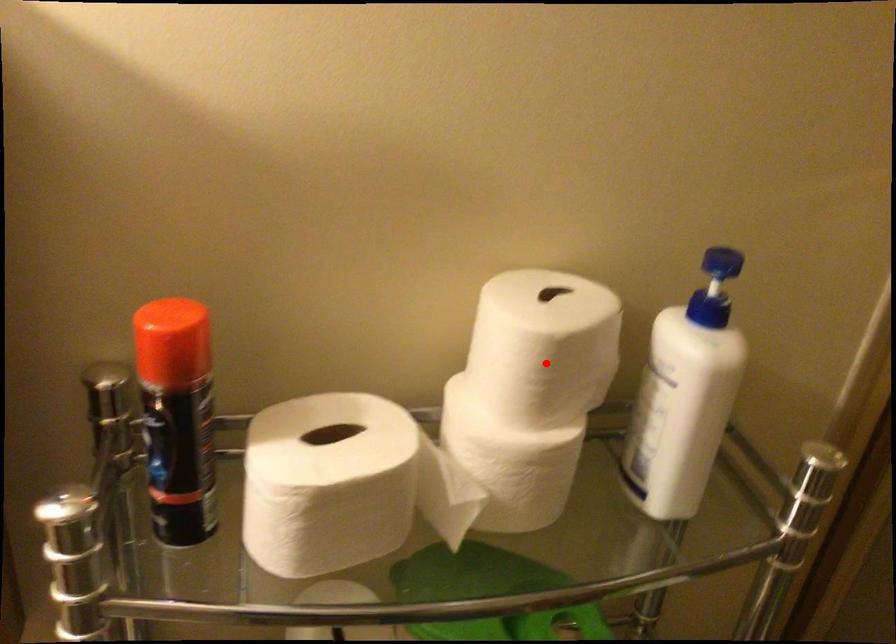
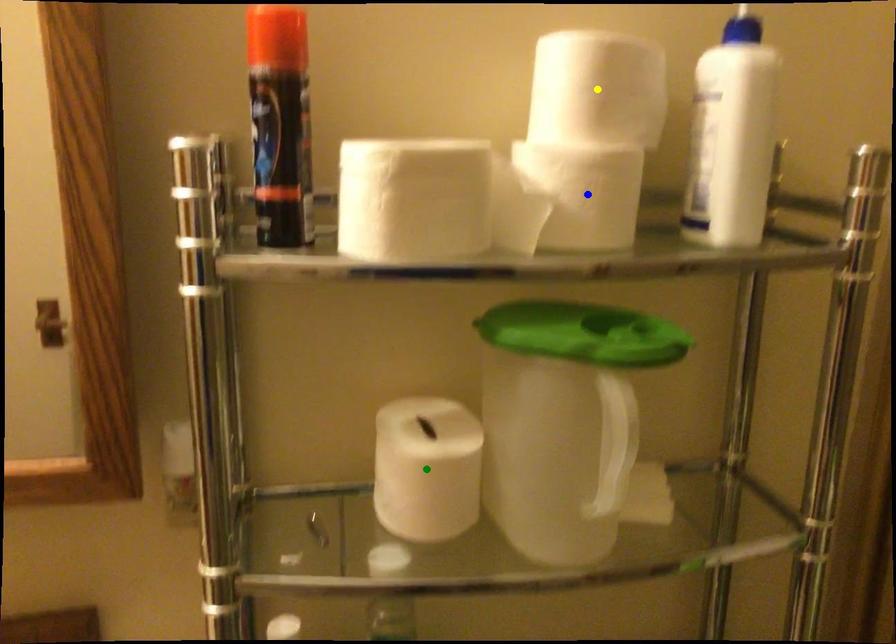
Question: I am providing you with two images of the same scene from different viewpoints. A red point is marked on the first image. You are given multiple points on the second image. Which point in image 2 is actually the same real-world point as the red point in image 1?

Choices:
 (A) green point
 (B) yellow point
 (C) blue point

Answer: (B)